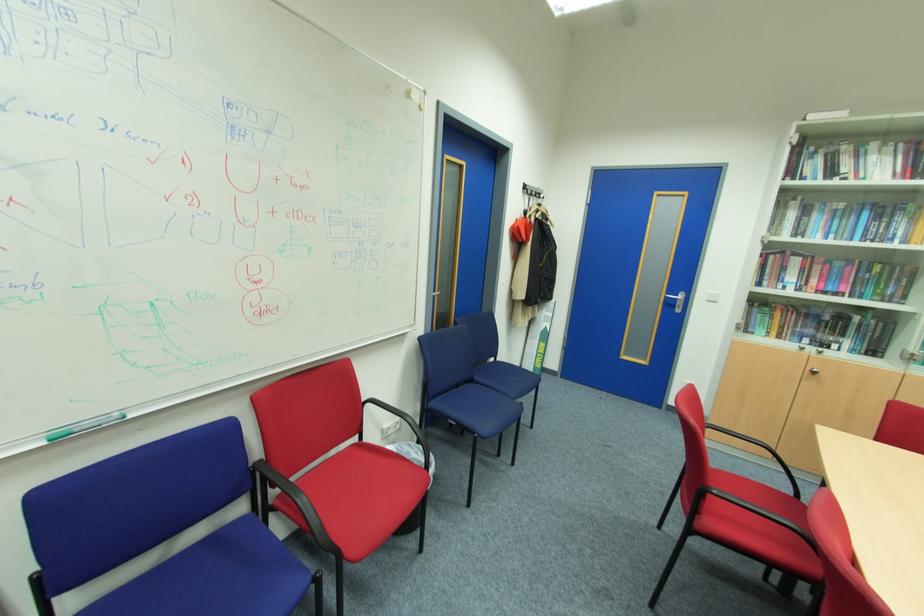
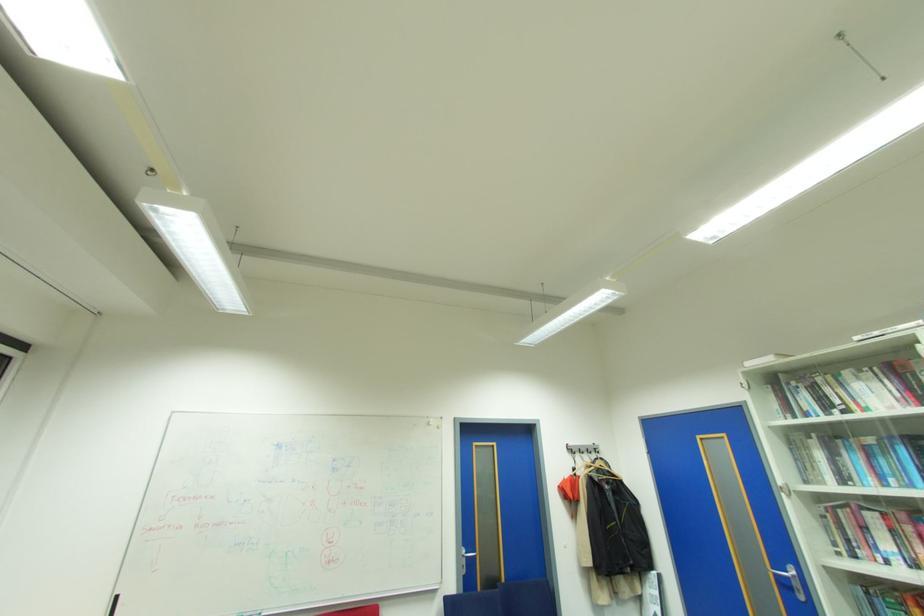
Find the pixel in the second image that matches pixel 821 205 in the first image.

(843, 442)